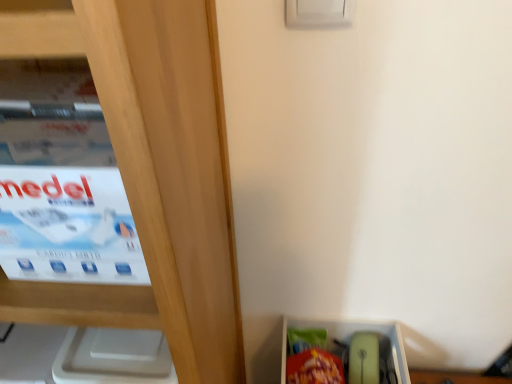
Question: Is white cardboard box at left inside or outside of matte plastic storage box at lower right?

Choices:
 (A) outside
 (B) inside

Answer: (A)

Question: Is white cardboard box at left bigger or smaller than matte plastic storage box at lower right?

Choices:
 (A) small
 (B) big

Answer: (A)

Question: From a real-world perspective, is white cardboard box at left above or below matte plastic storage box at lower right?

Choices:
 (A) above
 (B) below

Answer: (A)

Question: Considering the positions of point (314, 350) and point (133, 244), is point (314, 350) closer or farther from the camera than point (133, 244)?

Choices:
 (A) closer
 (B) farther

Answer: (B)

Question: From a real-world perspective, is matte plastic storage box at lower right physically located above or below white cardboard box at left?

Choices:
 (A) above
 (B) below

Answer: (B)

Question: In the image, is matte plastic storage box at lower right positioned in front of or behind white cardboard box at left?

Choices:
 (A) behind
 (B) front

Answer: (A)

Question: Would you say matte plastic storage box at lower right is inside or outside white cardboard box at left?

Choices:
 (A) inside
 (B) outside

Answer: (B)